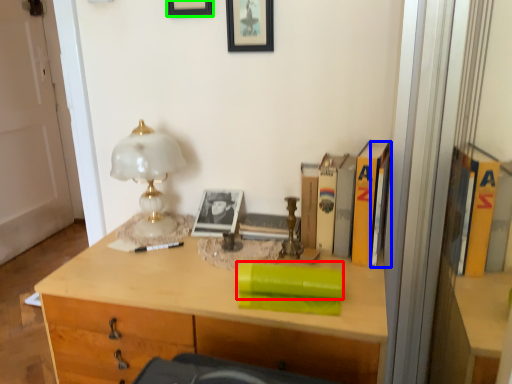
Question: Which object is the closest to the book (highlighted by a red box)? Choose among these: book (highlighted by a blue box) or picture frame (highlighted by a green box).

Choices:
 (A) book
 (B) picture frame

Answer: (A)